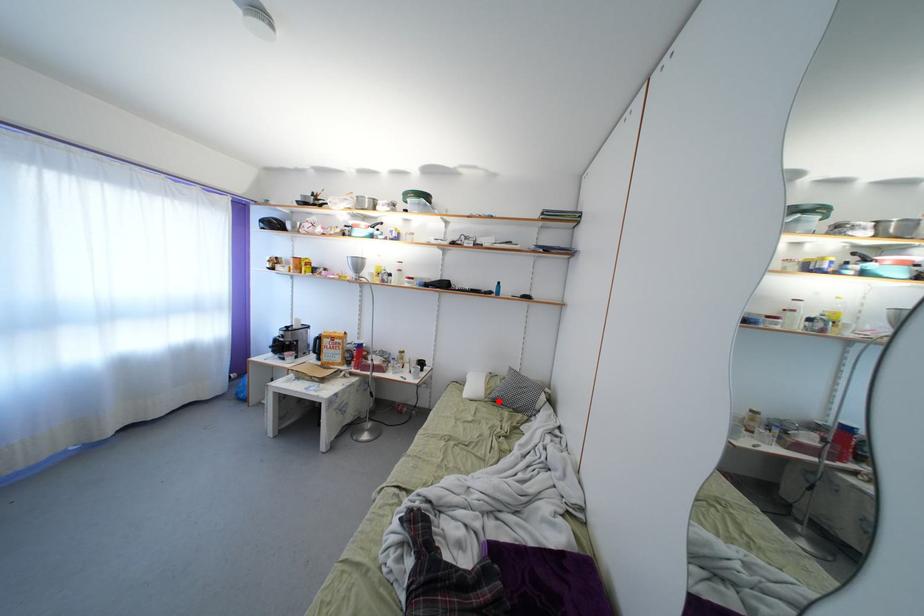
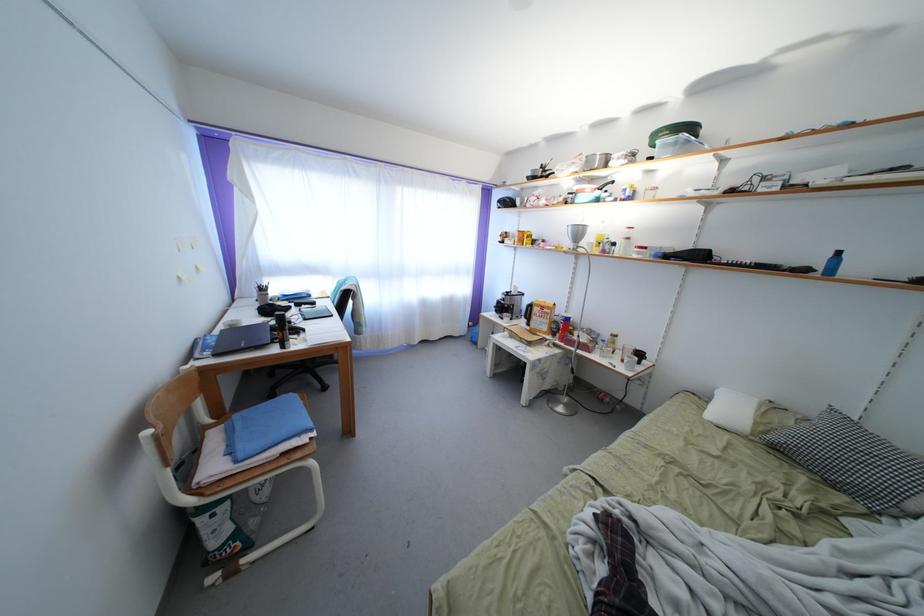
Where in the second image is the point corresponding to the highlighted location from the first image?

(779, 444)